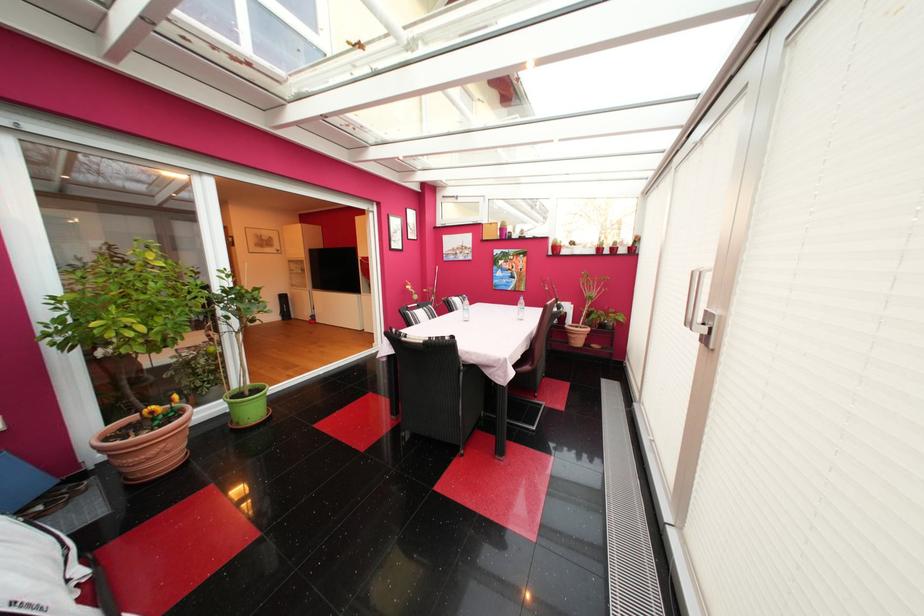
What do you see at coordinates (247, 405) in the screenshot?
I see `the green plant pot` at bounding box center [247, 405].